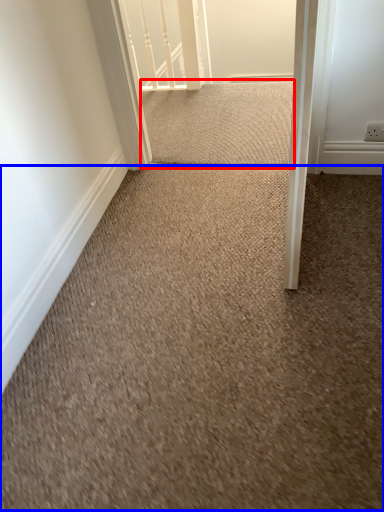
Question: Which object is further to the camera taking this photo, doormat (highlighted by a red box) or granite (highlighted by a blue box)?

Choices:
 (A) doormat
 (B) granite

Answer: (A)